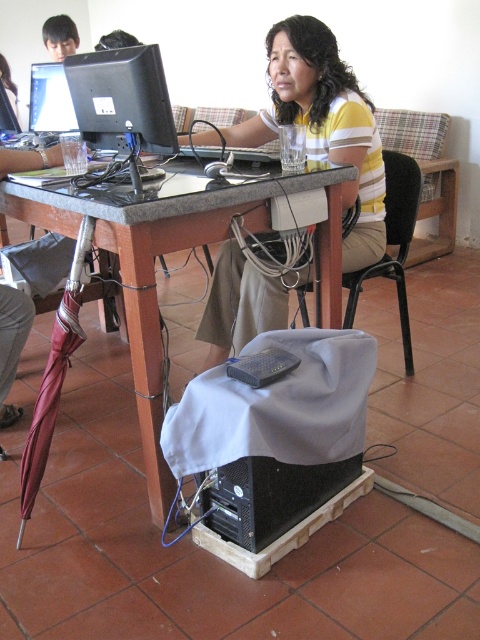
Question: Based on their relative distances, which object is farther from the black plastic keyboard at lower center?

Choices:
 (A) smooth skin face at upper left
 (B) matte black monitor at upper left
 (C) wooden table at center
 (D) yellow striped shirt at upper center

Answer: (A)

Question: Which object is farther from the camera taking this photo?

Choices:
 (A) black plastic keyboard at lower center
 (B) smooth skin face at upper left
 (C) matte black monitor at upper left

Answer: (B)

Question: Which object is the closest to the matte black monitor at upper left?

Choices:
 (A) black plastic keyboard at lower center
 (B) yellow striped shirt at upper center
 (C) smooth skin face at upper left

Answer: (B)

Question: From the image, what is the correct spatial relationship of wooden table at center in relation to smooth skin face at upper left?

Choices:
 (A) left
 (B) right

Answer: (B)

Question: Is wooden table at center to the right of matte black monitor at upper left from the viewer's perspective?

Choices:
 (A) no
 (B) yes

Answer: (B)

Question: Is wooden table at center smaller than black plastic keyboard at lower center?

Choices:
 (A) yes
 (B) no

Answer: (B)